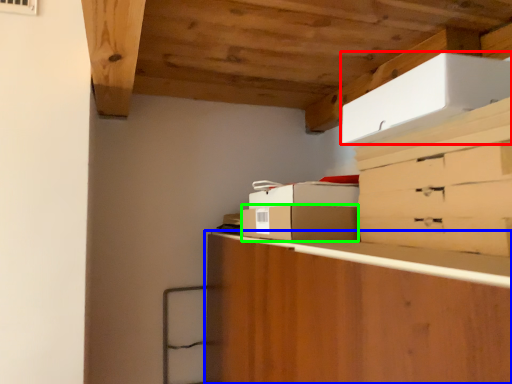
Question: Estimate the real-world distances between objects in this image. Which object is closer to cardboard box (highlighted by a red box), cabinetry (highlighted by a blue box) or cardboard box (highlighted by a green box)?

Choices:
 (A) cabinetry
 (B) cardboard box

Answer: (B)